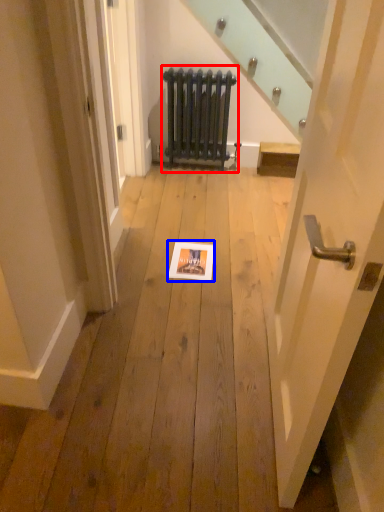
Question: Which object is further to the camera taking this photo, radiator (highlighted by a red box) or picture frame (highlighted by a blue box)?

Choices:
 (A) radiator
 (B) picture frame

Answer: (A)